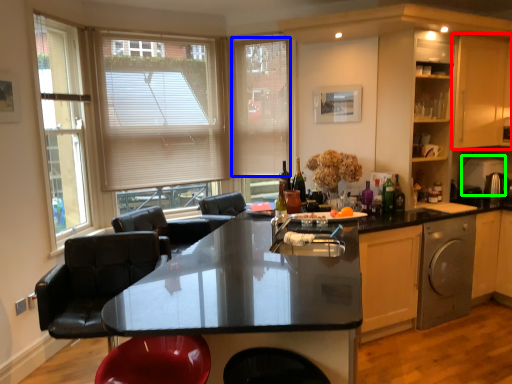
Question: Considering the real-world distances, which object is closest to cabinetry (highlighted by a red box)? blind (highlighted by a blue box) or appliance (highlighted by a green box).

Choices:
 (A) blind
 (B) appliance

Answer: (B)